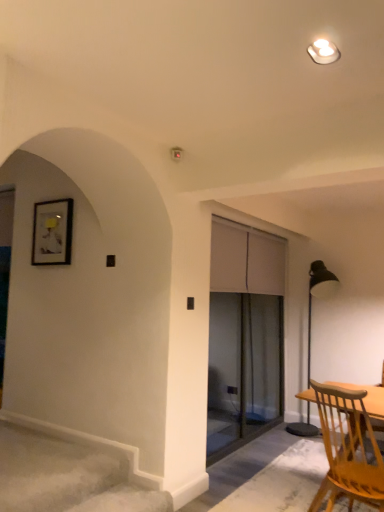
Question: Is light brown wooden chair at lower right a part of metallic black floor lamp at right?

Choices:
 (A) no
 (B) yes

Answer: (A)

Question: Would you say metallic black floor lamp at right is a long distance from light brown wooden chair at lower right?

Choices:
 (A) no
 (B) yes

Answer: (B)

Question: From a real-world perspective, is metallic black floor lamp at right positioned under light brown wooden chair at lower right based on gravity?

Choices:
 (A) no
 (B) yes

Answer: (A)

Question: Is metallic black floor lamp at right positioned beyond the bounds of light brown wooden chair at lower right?

Choices:
 (A) yes
 (B) no

Answer: (A)

Question: From the image's perspective, is metallic black floor lamp at right beneath light brown wooden chair at lower right?

Choices:
 (A) no
 (B) yes

Answer: (A)

Question: In terms of height, does metallic black floor lamp at right look taller or shorter compared to light brown wooden chair at lower right?

Choices:
 (A) short
 (B) tall

Answer: (B)

Question: Considering the relative positions of metallic black floor lamp at right and light brown wooden chair at lower right in the image provided, is metallic black floor lamp at right to the left or to the right of light brown wooden chair at lower right?

Choices:
 (A) left
 (B) right

Answer: (B)

Question: In terms of width, does metallic black floor lamp at right look wider or thinner when compared to light brown wooden chair at lower right?

Choices:
 (A) wide
 (B) thin

Answer: (B)

Question: Choose the correct answer: Is metallic black floor lamp at right inside light brown wooden chair at lower right or outside it?

Choices:
 (A) outside
 (B) inside

Answer: (A)

Question: Is light brown wooden chair at lower right in front of or behind white glossy light fixture at upper center in the image?

Choices:
 (A) behind
 (B) front

Answer: (A)

Question: From the image's perspective, is light brown wooden chair at lower right located above or below white glossy light fixture at upper center?

Choices:
 (A) above
 (B) below

Answer: (B)

Question: Is light brown wooden chair at lower right wider or thinner than white glossy light fixture at upper center?

Choices:
 (A) thin
 (B) wide

Answer: (B)

Question: From a real-world perspective, is light brown wooden chair at lower right positioned above or below white glossy light fixture at upper center?

Choices:
 (A) below
 (B) above

Answer: (A)

Question: Which is correct: metallic black floor lamp at right is inside white glossy light fixture at upper center, or outside of it?

Choices:
 (A) outside
 (B) inside

Answer: (A)

Question: Considering the positions of metallic black floor lamp at right and white glossy light fixture at upper center in the image, is metallic black floor lamp at right wider or thinner than white glossy light fixture at upper center?

Choices:
 (A) thin
 (B) wide

Answer: (B)